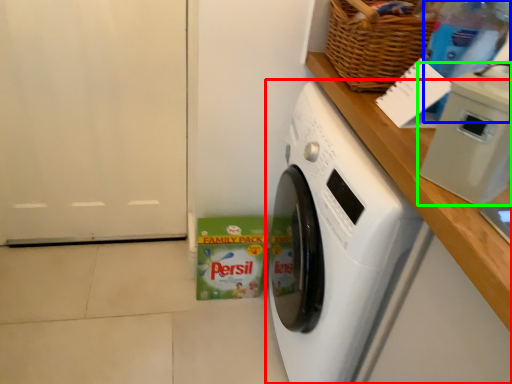
Question: Estimate the real-world distances between objects in this image. Which object is farther from washing machine (highlighted by a red box), bottle (highlighted by a blue box) or appliance (highlighted by a green box)?

Choices:
 (A) bottle
 (B) appliance

Answer: (A)